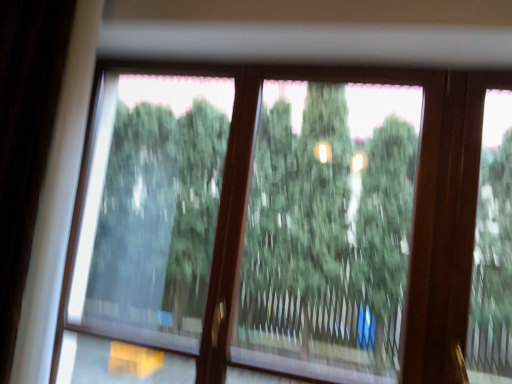
Question: Is point (382, 296) closer or farther from the camera than point (116, 316)?

Choices:
 (A) closer
 (B) farther

Answer: (B)

Question: Is green matte tree at center, which ranks as the second tree in left-to-right order, bigger or smaller than green matte tree at center, the first tree from the left?

Choices:
 (A) small
 (B) big

Answer: (B)

Question: In the image, is green matte tree at center, positioned as the 1th tree in right-to-left order, positioned in front of or behind green matte tree at center, acting as the second tree starting from the right?

Choices:
 (A) behind
 (B) front

Answer: (B)

Question: Would you say green matte tree at center, acting as the second tree starting from the right, is inside or outside green matte tree at center, positioned as the 1th tree in right-to-left order?

Choices:
 (A) inside
 (B) outside

Answer: (B)

Question: Is green matte tree at center, the first tree from the left, wider or thinner than green matte tree at center, positioned as the 1th tree in right-to-left order?

Choices:
 (A) wide
 (B) thin

Answer: (B)

Question: Relative to green matte tree at center, which ranks as the second tree in left-to-right order, is green matte tree at center, the first tree from the left, in front or behind?

Choices:
 (A) behind
 (B) front

Answer: (A)

Question: In terms of height, does green matte tree at center, acting as the second tree starting from the right, look taller or shorter compared to green matte tree at center, positioned as the 1th tree in right-to-left order?

Choices:
 (A) short
 (B) tall

Answer: (B)